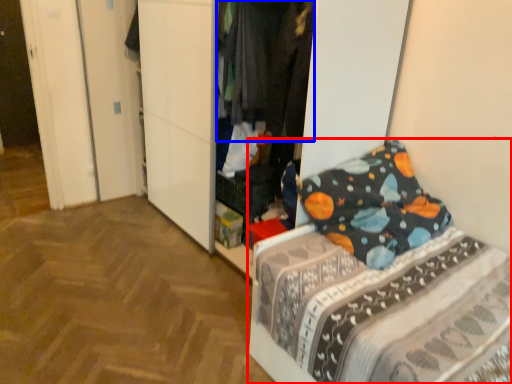
Question: Which of the following is the closest to the observer, bed (highlighted by a red box) or clothing (highlighted by a blue box)?

Choices:
 (A) bed
 (B) clothing

Answer: (A)